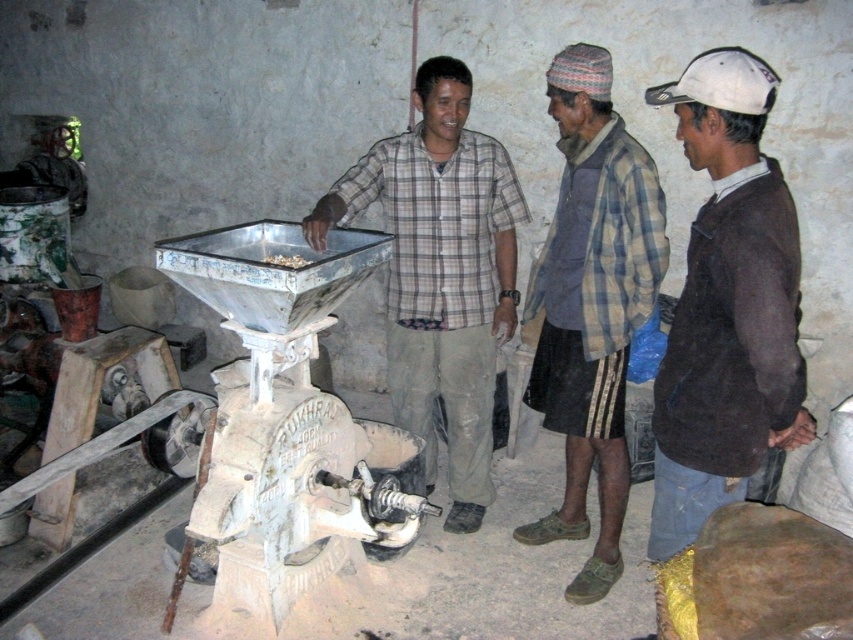
Does brown sweater at right come in front of plaid shirt at center?

Yes.

Is brown sweater at right below plaid shirt at center?

Correct, brown sweater at right is located below plaid shirt at center.

The image size is (853, 640). I want to click on brown sweater at right, so click(726, 305).

Which is below, plaid fabric shirt at center or white matte food at center?

plaid fabric shirt at center is below.

Between plaid fabric shirt at center and white matte food at center, which one is positioned higher?

white matte food at center is above.

Which is in front, point (592, 168) or point (288, 257)?

Point (288, 257) is in front.

I want to click on plaid fabric shirt at center, so click(x=590, y=305).

Does brown sweater at right appear on the left side of white matte food at center?

Incorrect, brown sweater at right is not on the left side of white matte food at center.

Measure the distance between brown sweater at right and camera.

brown sweater at right is 5.89 feet away from camera.

Which is behind, point (653, 540) or point (268, 253)?

Positioned behind is point (268, 253).

Find the location of `brown sweater at right`. brown sweater at right is located at coordinates (726, 305).